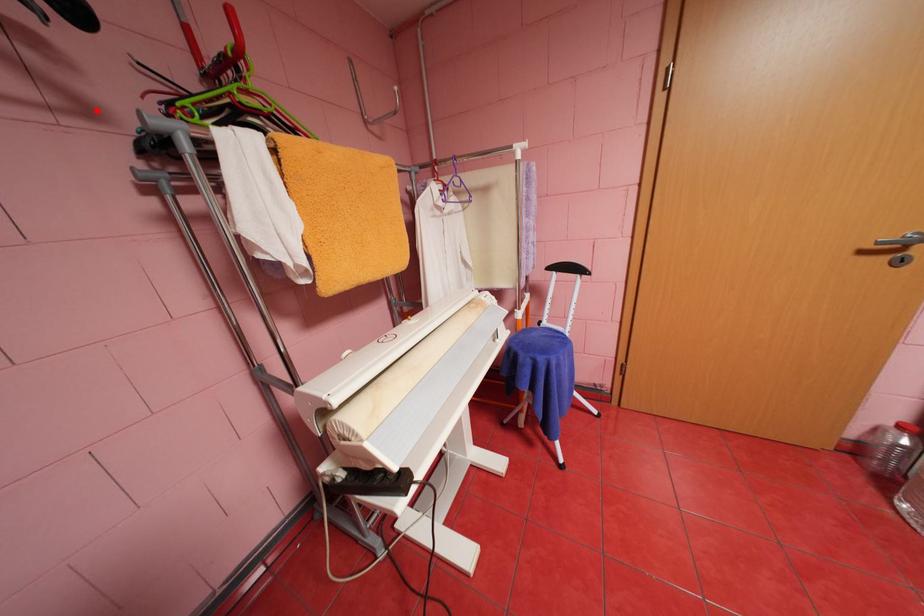
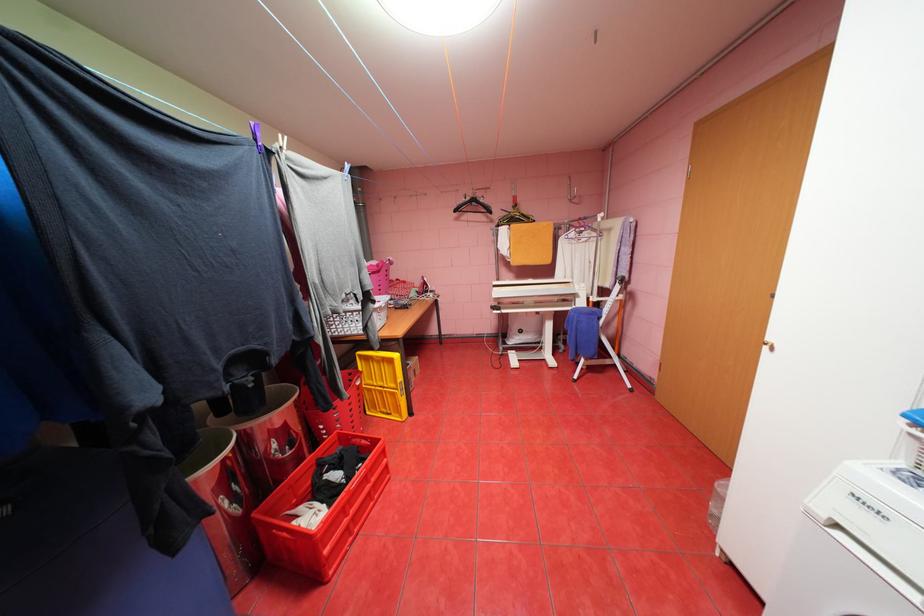
The point at the highlighted location is marked in the first image. Where is the corresponding point in the second image?

(500, 221)